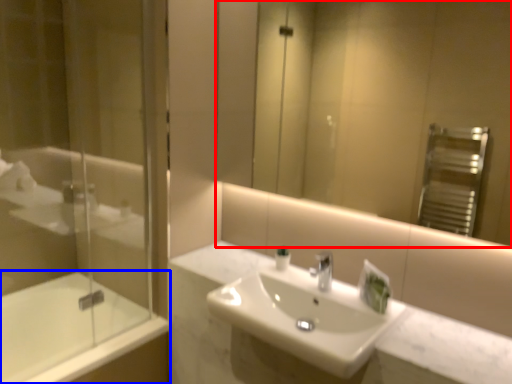
Question: Which point is further to the camera, mirror (highlighted by a red box) or bathtub (highlighted by a blue box)?

Choices:
 (A) mirror
 (B) bathtub

Answer: (B)